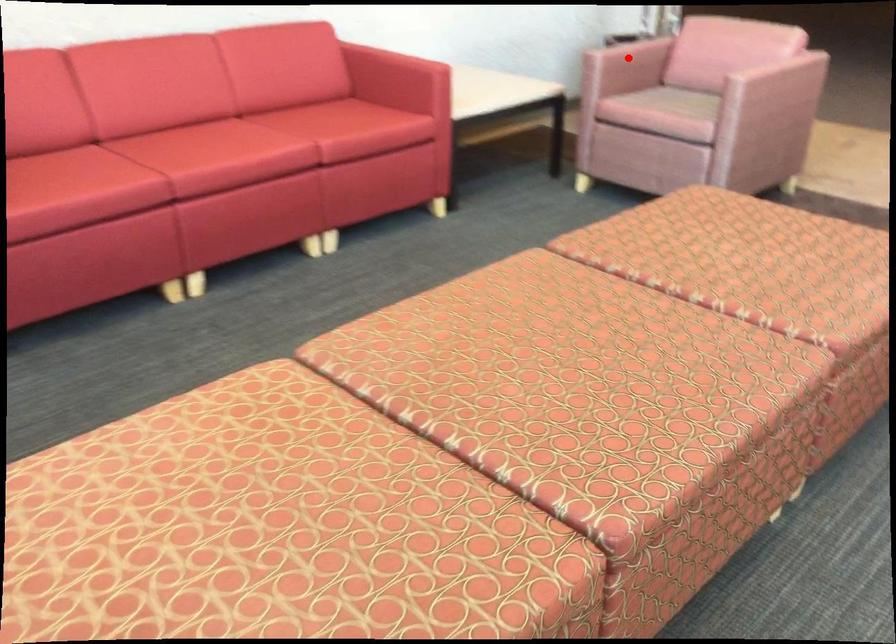
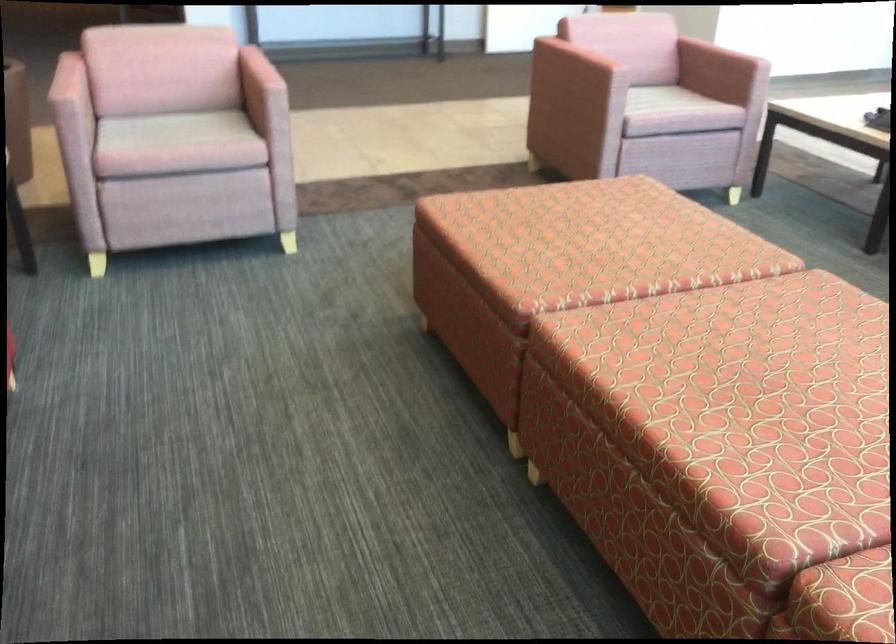
Question: I am providing you with two images of the same scene from different viewpoints. A red point is marked on the first image. Can you still see the location of the red point in image 2?

Choices:
 (A) Yes
 (B) No

Answer: (B)